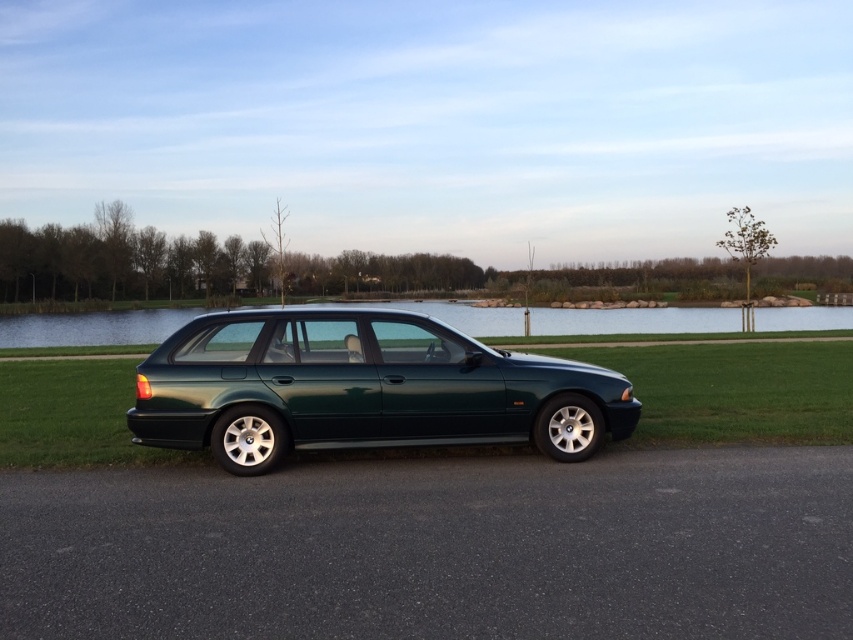
Can you confirm if metallic green wagon at center is positioned to the left of transparent glass water at center?

Incorrect, metallic green wagon at center is not on the left side of transparent glass water at center.

Does metallic green wagon at center have a lesser width compared to transparent glass water at center?

Correct, metallic green wagon at center's width is less than transparent glass water at center's.

Find the location of a particular element. This screenshot has height=640, width=853. metallic green wagon at center is located at coordinates [x=363, y=388].

At what (x,y) coordinates should I click in order to perform the action: click on metallic green wagon at center. Please return your answer as a coordinate pair (x, y). This screenshot has width=853, height=640. Looking at the image, I should click on (363, 388).